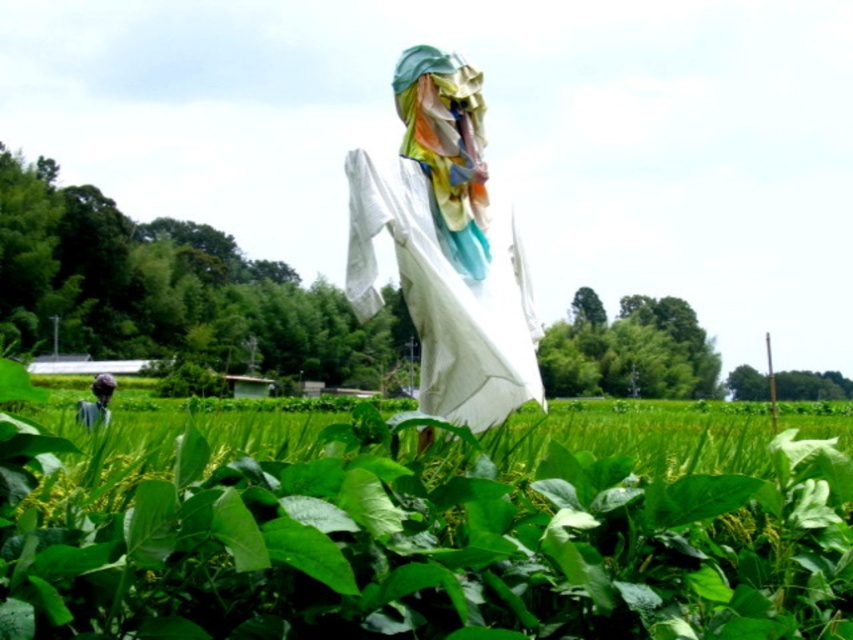
You are standing in the rural field and see the white cloth at center and the dark blue fabric at lower left. Which object is positioned more towards the east if the sun is setting in the west?

The white cloth at center is positioned more towards the east because it is to the right of the dark blue fabric at lower left, and since the sun is setting in the west, east would be to the right from the observer.

Based on the photo, you are a farmer in the field and you want to cover a small plant with one of the fabrics. Which fabric would you choose between the white cloth at center and the dark blue fabric at lower left?

The white cloth at center is smaller than the dark blue fabric at lower left, so you should choose the white cloth at center to cover the small plant.

You are standing in the rural scene depicted in the image. There is a point marked at coordinates (445, 246) which corresponds to an object in the scene. What object is located at this point?

The point at (445, 246) marks the location of the white cloth at center.